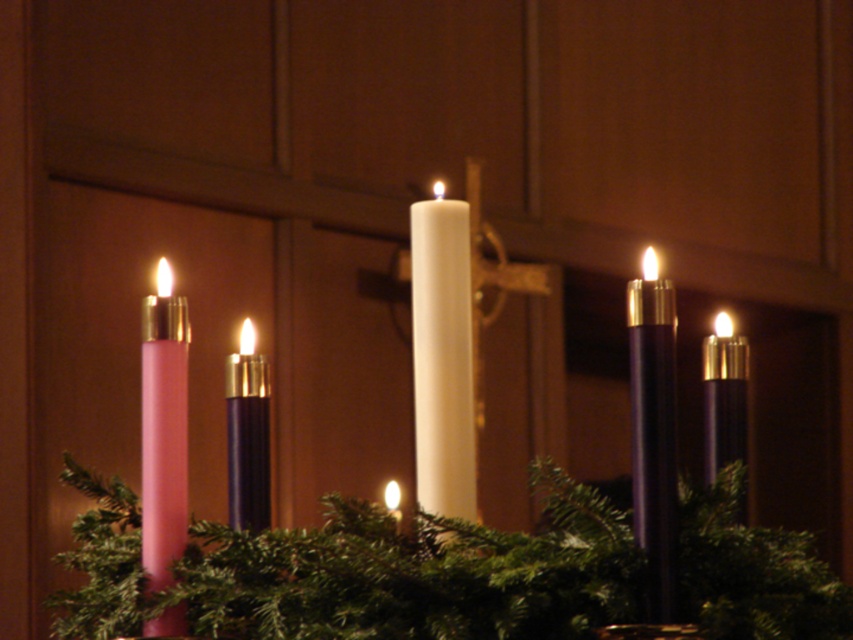
You are an interior designer planning to place a decorative star ornament on the Advent wreath. The star must be placed at the exact center of the wreath. Given the white matte candle at center is located at coordinates 0.559, 0.519, is the candle positioned exactly at the center of the wreath?

The white matte candle at center is located at coordinates (442, 356), which indicates it is not exactly at the center of the wreath since the true center would be at coordinates (426, 320).

You are an observer standing in front of the Advent wreath. You see the white matte candle at center and the matte purple candle at right. Which candle is positioned closer to your left side?

The white matte candle at center is positioned closer to your left side because it is to the left of the matte purple candle at right.

You are an interior designer planning to place a decorative item between the white matte candle at center and the purple matte candle at center on the Advent wreath. Given their widths, which candle should the item be placed closer to to ensure it doesn

The white matte candle at center has a lesser width compared to the purple matte candle at center, so the decorative item should be placed closer to the white matte candle at center to maintain balance between the two candles.